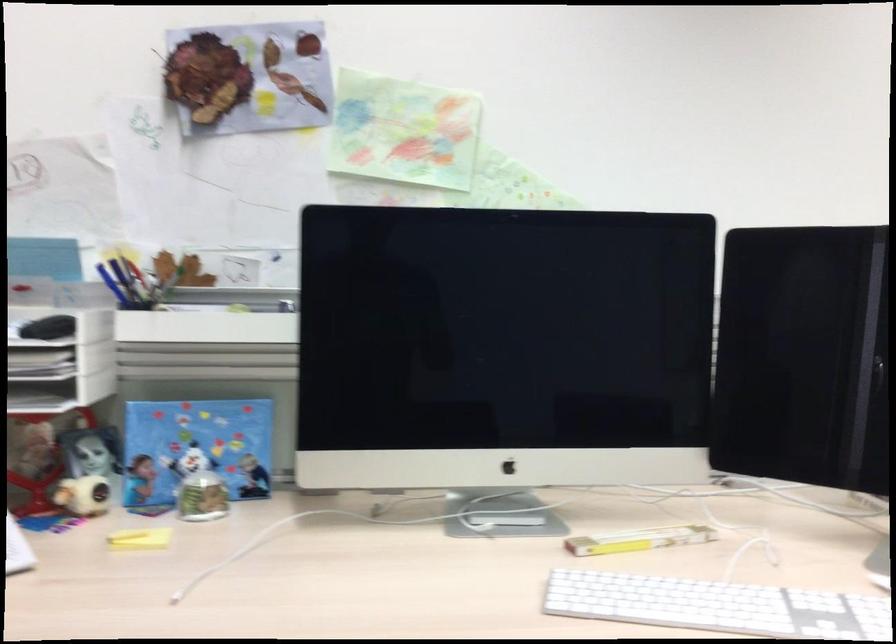
Image resolution: width=896 pixels, height=644 pixels. Describe the element at coordinates (449, 494) in the screenshot. I see `the white cable connector` at that location.